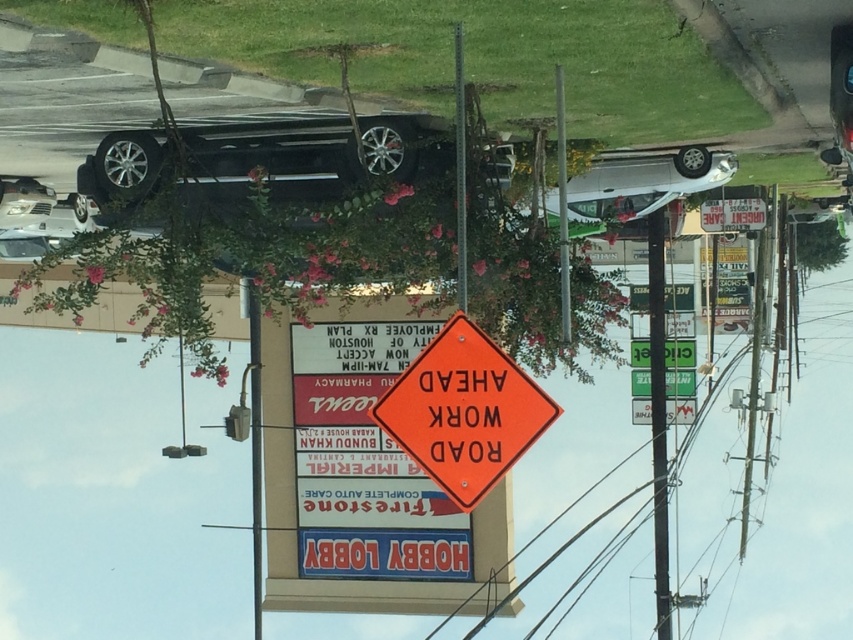
Does metallic pole at center-right lie in front of orange plastic diamond at center?

Yes, metallic pole at center-right is closer to the viewer.

Can you confirm if metallic pole at center-right is wider than orange plastic diamond at center?

Yes.

You are a GUI agent. You are given a task and a screenshot of the screen. Output one action in this format:
    pyautogui.click(x=<x>, y=<y>)
    Task: Click on the metallic pole at center-right
    
    Given the screenshot: What is the action you would take?
    pyautogui.click(x=659, y=419)

Is orange plastic road work sign at center wider than white matte car at upper right?

Incorrect, orange plastic road work sign at center's width does not surpass white matte car at upper right's.

The width and height of the screenshot is (853, 640). What are the coordinates of `orange plastic road work sign at center` in the screenshot? It's located at (463, 412).

The height and width of the screenshot is (640, 853). In order to click on orange plastic road work sign at center in this screenshot , I will do `click(463, 412)`.

Is orange reflective road work sign at center to the right of orange plastic road work sign at center from the viewer's perspective?

No, orange reflective road work sign at center is not to the right of orange plastic road work sign at center.

Is point (341, 465) positioned behind point (503, 387)?

Yes, it is.

Image resolution: width=853 pixels, height=640 pixels. In order to click on orange reflective road work sign at center in this screenshot , I will do `click(364, 461)`.